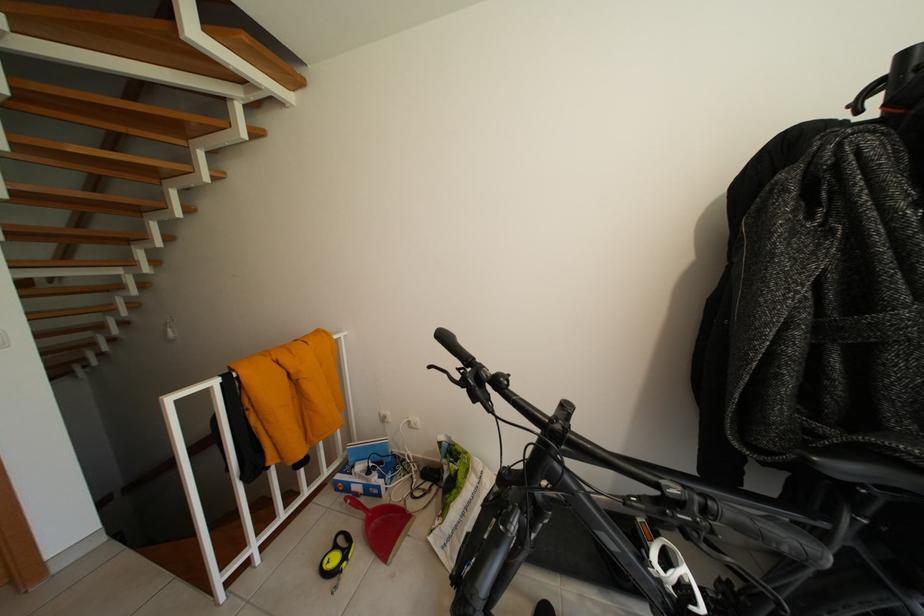
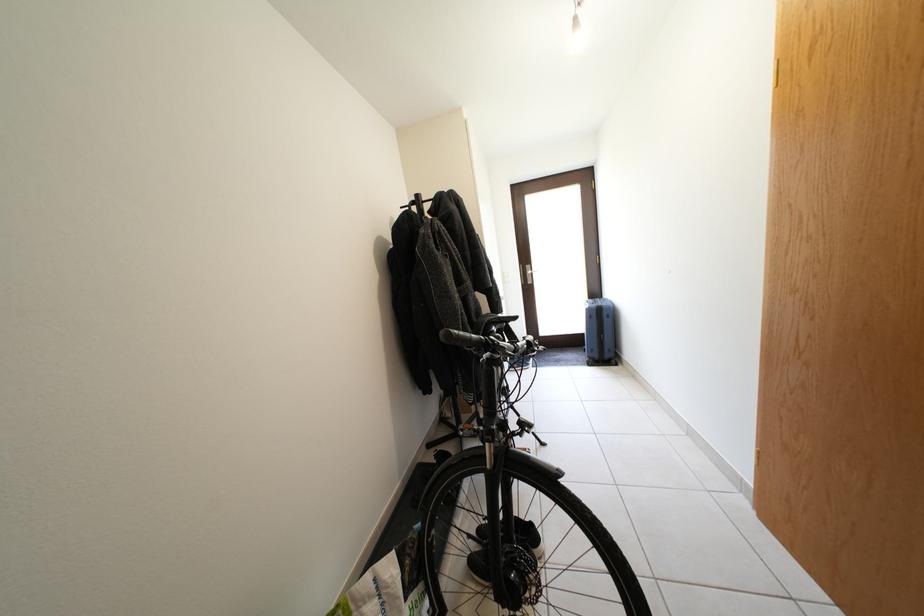
Question: The images are taken continuously from a first-person perspective. In which direction is your viewpoint rotating?

Choices:
 (A) Left
 (B) Right
 (C) Up
 (D) Down

Answer: (B)